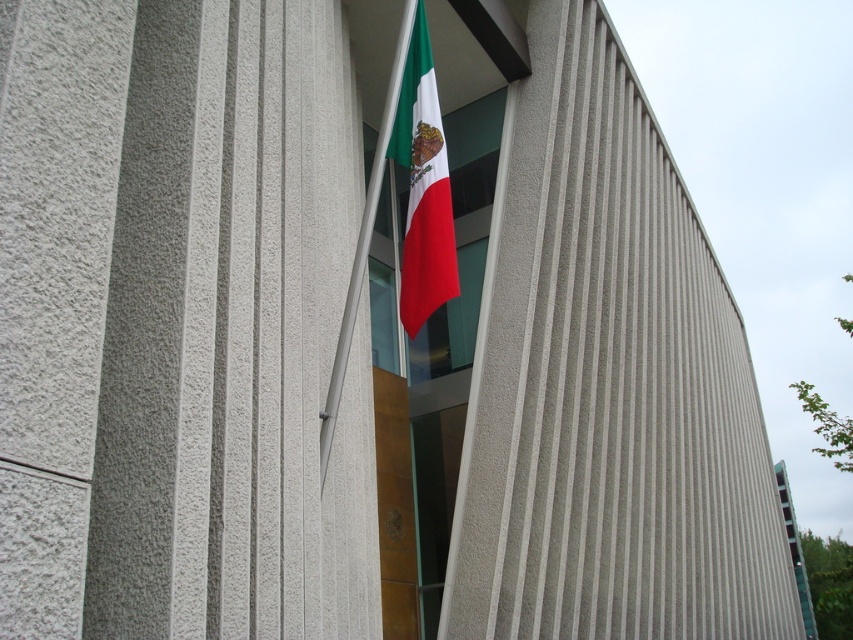
Question: Which point is farther to the camera?

Choices:
 (A) (424, 29)
 (B) (471, 273)

Answer: (B)

Question: Is glass window at center to the left of red fabric flag at center from the viewer's perspective?

Choices:
 (A) yes
 (B) no

Answer: (B)

Question: Does glass window at center come behind red fabric flag at center?

Choices:
 (A) no
 (B) yes

Answer: (B)

Question: Does glass window at center appear on the left side of red fabric flag at center?

Choices:
 (A) no
 (B) yes

Answer: (A)